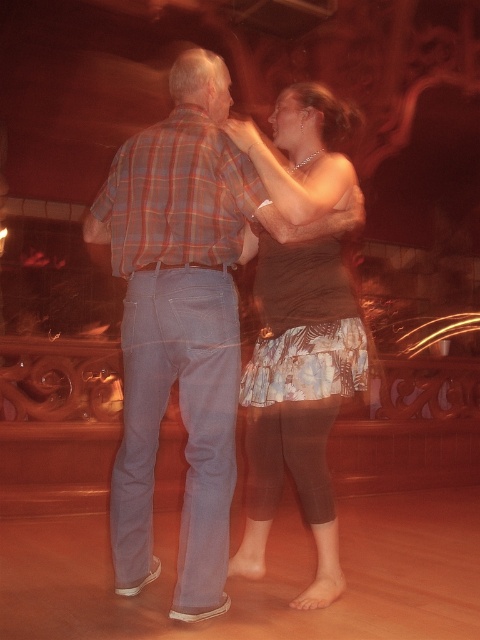
You are a photographer in the dance hall and want to capture a photo of the two dancers. You notice two points marked in the scene. The first point is at coordinate point (x=336, y=195) and the second is at point (x=203, y=225). Which point is closer to the camera?

Point (x=203, y=225) is closer to the camera because the point (x=336, y=195) is behind it.